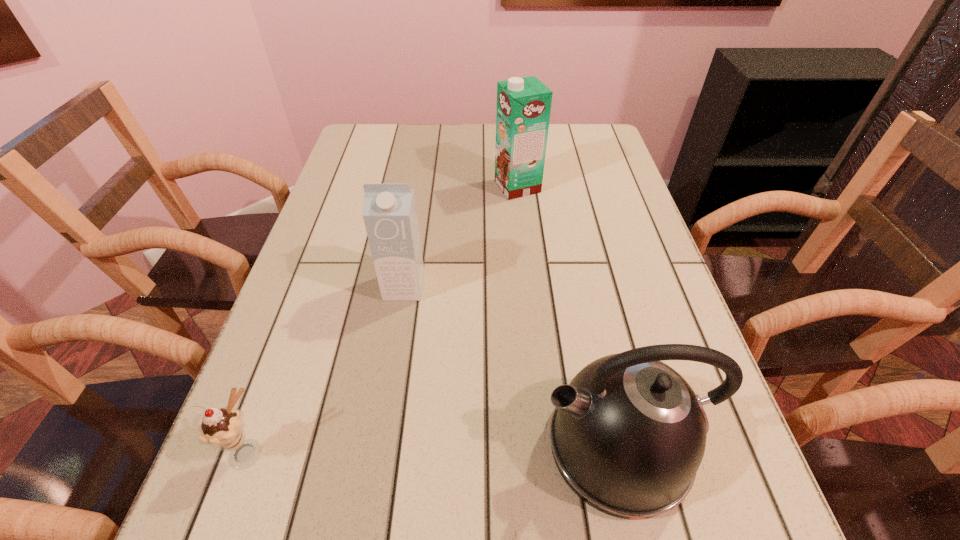
Locate an element on the screen. the second closest object relative to the leftmost object is located at coordinates (628, 434).

Point out which object is positioned as the second nearest to the left carton. Please provide its 2D coordinates. Your answer should be formatted as a tuple, i.e. [(x, y)], where the tuple contains the x and y coordinates of a point satisfying the conditions above.

[(223, 428)]